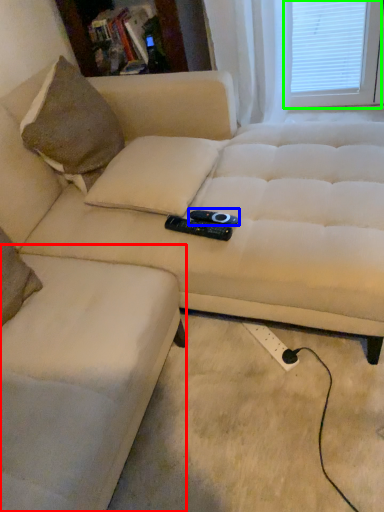
Question: Which object is the farthest from swivel chair (highlighted by a red box)? Choose among these: remote (highlighted by a blue box) or window screen (highlighted by a green box).

Choices:
 (A) remote
 (B) window screen

Answer: (B)